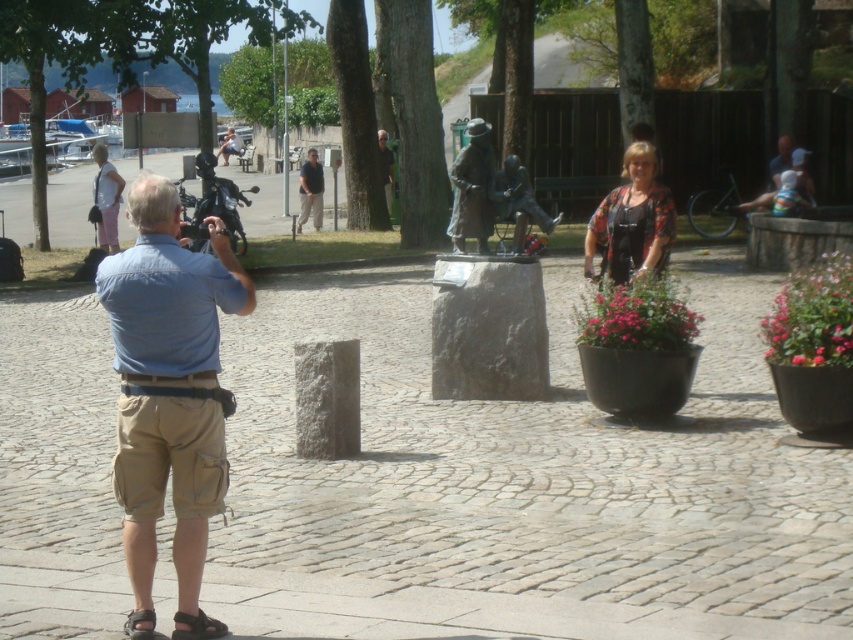
You are standing in the public square and want to take a photo of the bronze statue at center. According to the scene description, where should you position yourself to capture the statue in the frame?

The bronze statue at center is located at coordinates point (473, 188), so you should position yourself facing that point to capture it in the frame.

You are the photographer in the scene. You want to take a photo that includes both the bronze statue at center and the stone pedestal to its right. Can you fit both in your camera frame if your camera has a 60cm field of view?

The bronze statue at center and the stone pedestal to its right are 13.38 meters apart. Since the camera has a 60cm field of view, which is much smaller than the distance between them, you cannot fit both in the frame.

Based on the photo, you are the photographer in the scene. You want to capture both the bronze statue at center and the matte black helmet at center in the same frame. Since your camera has a limited field of view, which object should you position closer to the center of the frame to include both?

The bronze statue at center is to the right of the matte black helmet at center. To include both in the frame, position the matte black helmet at center closer to the center of the frame since it is on the left side, allowing the bronze statue at center to be on the right within the field of view.